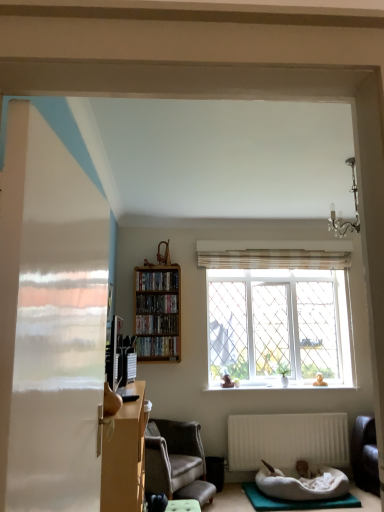
Question: Considering the positions of point (140, 408) and point (165, 271), is point (140, 408) closer or farther from the camera than point (165, 271)?

Choices:
 (A) farther
 (B) closer

Answer: (B)

Question: Is matte brown desk at left spatially inside wooden shelf at upper center, the 1th book in the top-to-bottom sequence, or outside of it?

Choices:
 (A) outside
 (B) inside

Answer: (A)

Question: Which is nearer to the black glossy bookshelf at center, the 3th book when ordered from top to bottom?

Choices:
 (A) white fluffy pet bed at lower center
 (B) matte brown desk at left
 (C) wooden bookshelf at center
 (D) teal fabric yoga mat at lower right
 (E) matte black bookshelf at center, which is the first book from bottom to top

Answer: (C)

Question: Estimate the real-world distances between objects in this image. Which object is closer to the white glass window at center?

Choices:
 (A) white fluffy pet bed at lower center
 (B) matte brown desk at left
 (C) teal fabric yoga mat at lower right
 (D) white matte radiator at lower center
 (E) dark gray fabric chair at lower left

Answer: (D)